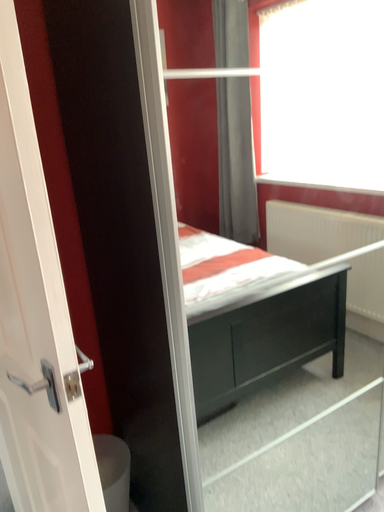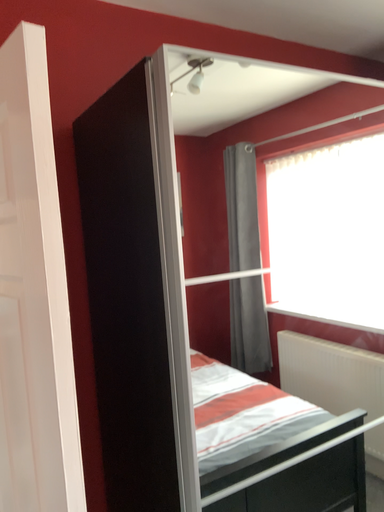
Question: Which way did the camera rotate in the video?

Choices:
 (A) rotated upward
 (B) rotated downward

Answer: (A)